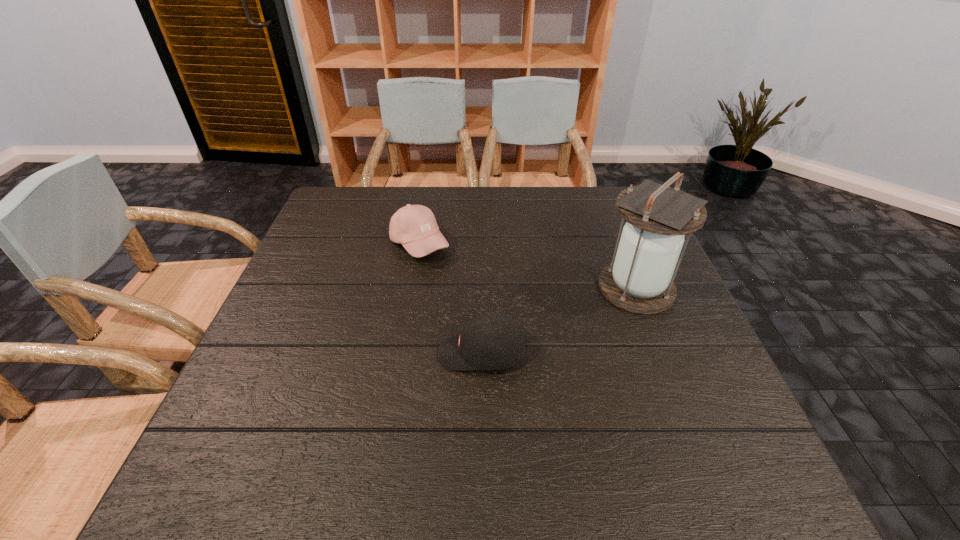
The height and width of the screenshot is (540, 960). Find the location of `unoccupied area between the farther baseball cap and the nearer baseball cap`. unoccupied area between the farther baseball cap and the nearer baseball cap is located at coordinates (451, 299).

The width and height of the screenshot is (960, 540). Find the location of `vacant space that's between the farther baseball cap and the rightmost object`. vacant space that's between the farther baseball cap and the rightmost object is located at coordinates (528, 266).

The width and height of the screenshot is (960, 540). In order to click on vacant area that lies between the farther baseball cap and the nearer baseball cap in this screenshot , I will do `click(451, 299)`.

Where is `blank region between the nearer baseball cap and the farther baseball cap`? This screenshot has width=960, height=540. blank region between the nearer baseball cap and the farther baseball cap is located at coordinates (451, 299).

Locate an element on the screen. free space that is in between the rightmost object and the nearer baseball cap is located at coordinates (560, 321).

Where is `unoccupied area between the lantern and the nearest object`? This screenshot has height=540, width=960. unoccupied area between the lantern and the nearest object is located at coordinates (560, 321).

Where is `free space between the nearer baseball cap and the farther baseball cap`? free space between the nearer baseball cap and the farther baseball cap is located at coordinates (451, 299).

Locate which object ranks in proximity to the tallest object. Please provide its 2D coordinates. Your answer should be formatted as a tuple, i.e. [(x, y)], where the tuple contains the x and y coordinates of a point satisfying the conditions above.

[(492, 341)]

I want to click on object that is the closest one to the tallest object, so click(x=492, y=341).

This screenshot has width=960, height=540. What are the coordinates of `vacant space that satisfies the following two spatial constraints: 1. on the front-facing side of the farther baseball cap; 2. on the left side of the lantern` in the screenshot? It's located at (412, 288).